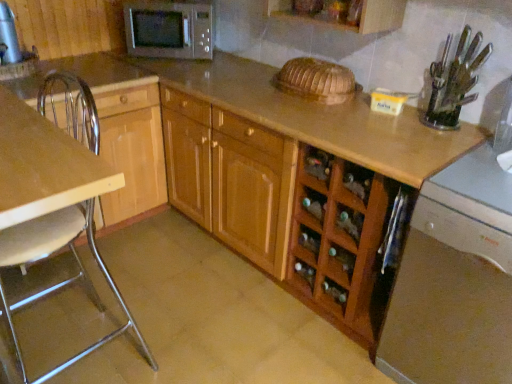
This screenshot has width=512, height=384. I want to click on vacant region to the right of brushed metal water heater at upper left, acting as the second appliance starting from the right, so click(37, 68).